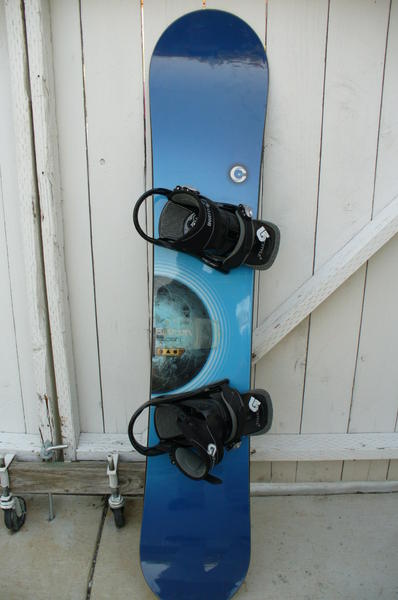
The height and width of the screenshot is (600, 398). I want to click on diagonal painted board, so click(323, 291).